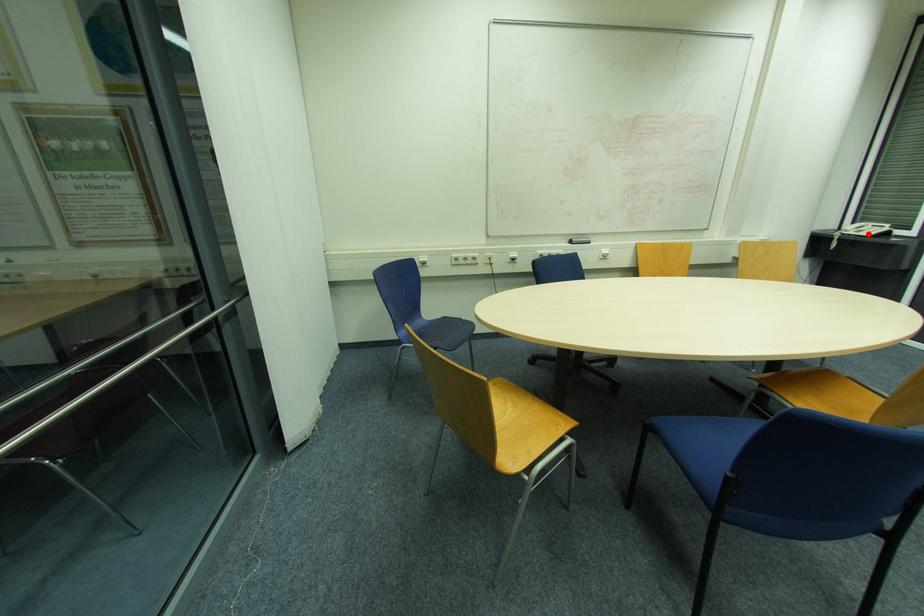
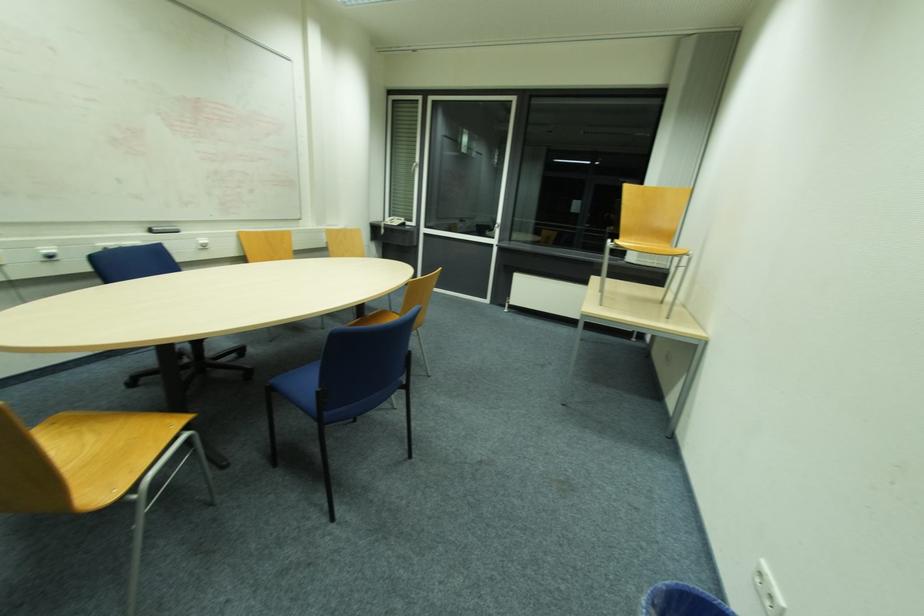
Question: I am providing you with two images of the same scene from different viewpoints. A red point is shown in image1. For the corresponding object point in image2, is it positioned nearer or farther from the camera?

Choices:
 (A) Nearer
 (B) Farther

Answer: (A)